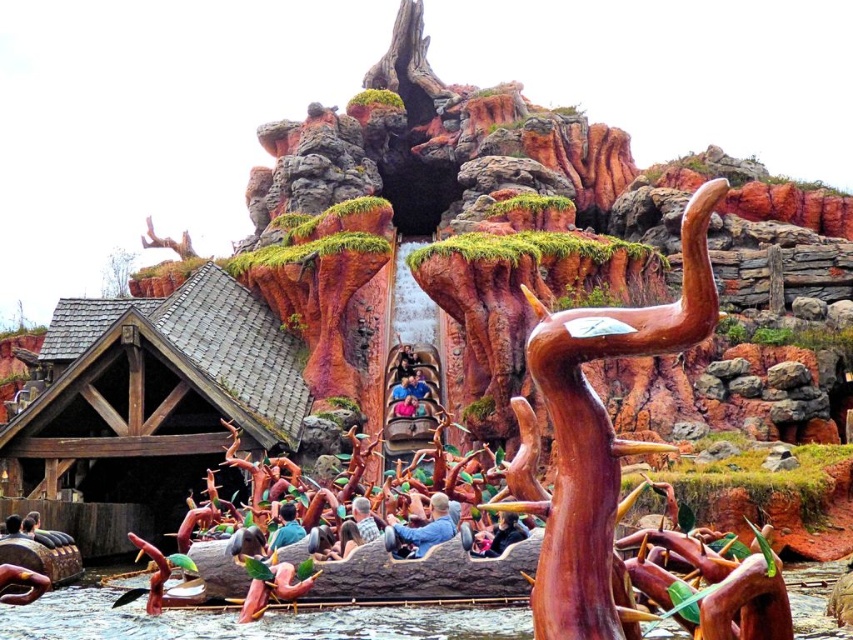
Is blue denim jacket at center above green mossy tree at upper left?

No.

Between blue denim jacket at center and green mossy tree at upper left, which one has less height?

blue denim jacket at center

Which is in front, point (454, 524) or point (112, 280)?

Positioned in front is point (454, 524).

Locate an element on the screen. This screenshot has width=853, height=640. blue denim jacket at center is located at coordinates (426, 528).

Who is positioned more to the right, brown wood sculpture at upper center or blue denim jacket at center?

Positioned to the right is brown wood sculpture at upper center.

Where is `brown wood sculpture at upper center`? This screenshot has width=853, height=640. brown wood sculpture at upper center is located at coordinates (598, 436).

The image size is (853, 640). Describe the element at coordinates (598, 436) in the screenshot. I see `brown wood sculpture at upper center` at that location.

Locate an element on the screen. brown wood sculpture at upper center is located at coordinates (598, 436).

Measure the distance between brown wood sculpture at upper center and camera.

39.13 meters

Between brown wood sculpture at upper center and green mossy tree at upper left, which one is positioned higher?

green mossy tree at upper left

Is point (593, 534) closer to viewer compared to point (103, 264)?

That is True.

In order to click on brown wood sculpture at upper center in this screenshot , I will do click(598, 436).